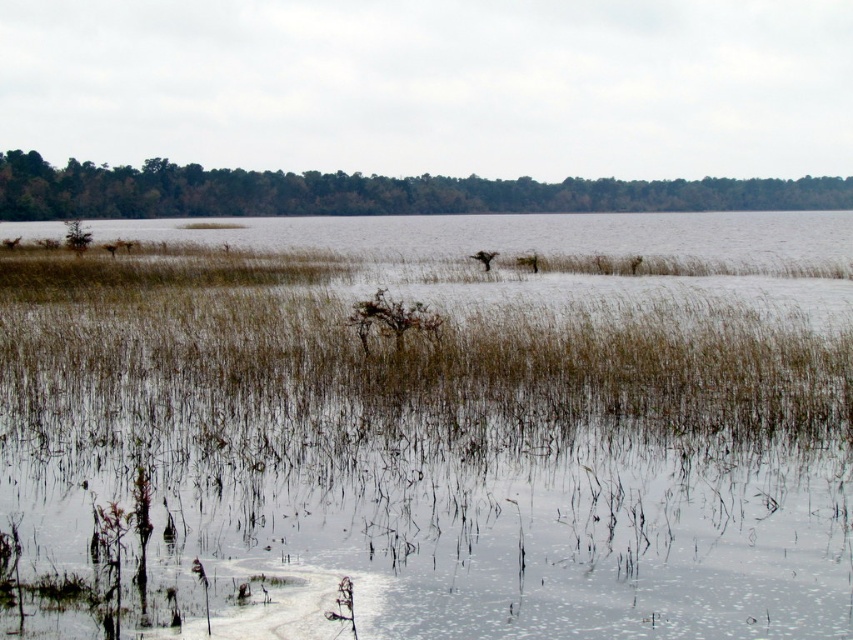
Does brown dry grass at center appear over green matte trees at upper center?

Incorrect, brown dry grass at center is not positioned above green matte trees at upper center.

How much distance is there between brown dry grass at center and green matte trees at upper center?

The distance of brown dry grass at center from green matte trees at upper center is 75.50 meters.

The height and width of the screenshot is (640, 853). Find the location of `brown dry grass at center`. brown dry grass at center is located at coordinates pos(433,428).